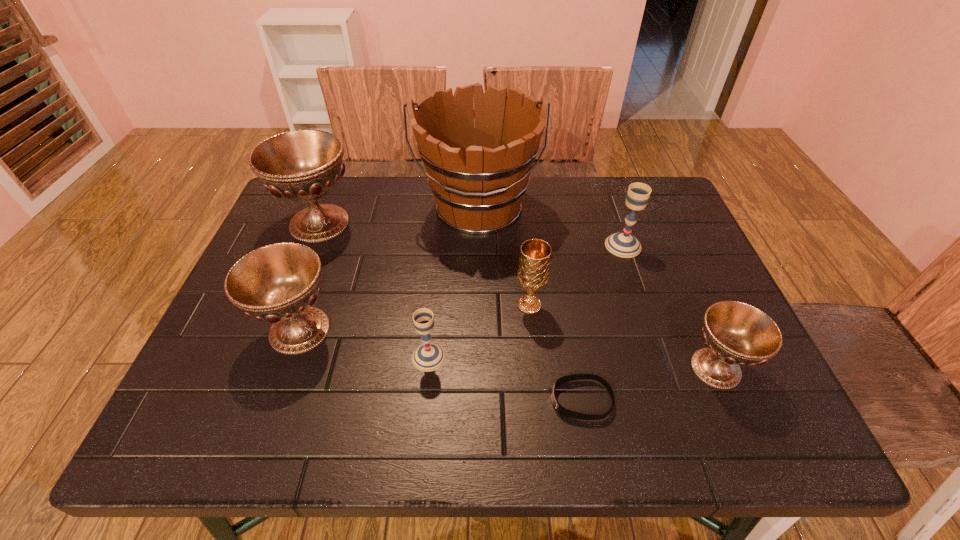
Image resolution: width=960 pixels, height=540 pixels. Find the location of `wine bucket`. wine bucket is located at coordinates (478, 185).

This screenshot has height=540, width=960. I want to click on the second tallest object, so click(303, 165).

This screenshot has height=540, width=960. What are the coordinates of `the tallest chalice` in the screenshot? It's located at (303, 165).

You are a GUI agent. You are given a task and a screenshot of the screen. Output one action in this format:
    pyautogui.click(x=<x>, y=<y>)
    Task: Click on the farther gray chalice
    
    Given the screenshot: What is the action you would take?
    click(x=623, y=244)

In order to click on the right gray chalice in this screenshot , I will do `click(623, 244)`.

What are the coordinates of `the second biggest red chalice` in the screenshot? It's located at (279, 283).

This screenshot has height=540, width=960. Find the location of `the fourth chalice from left to right`. the fourth chalice from left to right is located at coordinates (533, 269).

At what (x,y) coordinates should I click in order to perform the action: click on the smaller gray chalice. Please return your answer as a coordinate pair (x, y). Looking at the image, I should click on (427, 357).

Image resolution: width=960 pixels, height=540 pixels. I want to click on the nearer gray chalice, so click(x=427, y=357).

This screenshot has height=540, width=960. In order to click on the rightmost red chalice in this screenshot , I will do `click(737, 334)`.